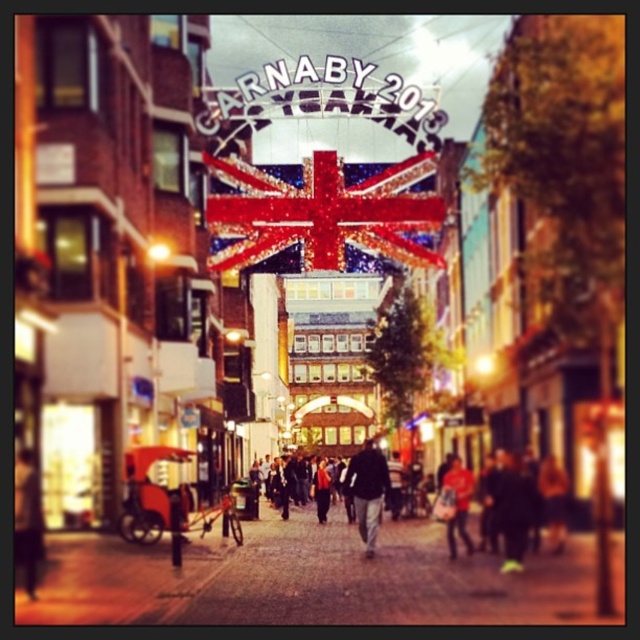
Who is more distant from viewer, (365, 474) or (464, 522)?

Point (365, 474)

Does dark gray jacket at center appear on the left side of red fabric jacket at center?

Indeed, dark gray jacket at center is positioned on the left side of red fabric jacket at center.

Where is `dark gray jacket at center`? The width and height of the screenshot is (640, 640). dark gray jacket at center is located at coordinates coord(368,492).

How distant is shiny fabric flag at center from red fabric jacket at center?

39.61 meters

Looking at this image, which is above, shiny fabric flag at center or red fabric jacket at center?

shiny fabric flag at center is above.

Where is `shiny fabric flag at center`? The image size is (640, 640). shiny fabric flag at center is located at coordinates (323, 212).

Measure the distance from shiny fabric flag at center to dark gray jacket at center.

A distance of 37.50 meters exists between shiny fabric flag at center and dark gray jacket at center.

Is point (365, 211) positioned after point (368, 472)?

Yes, it is behind point (368, 472).

Which is behind, point (237, 244) or point (355, 456)?

Positioned behind is point (355, 456).

Where is `shiny fabric flag at center`? The width and height of the screenshot is (640, 640). shiny fabric flag at center is located at coordinates (323, 212).